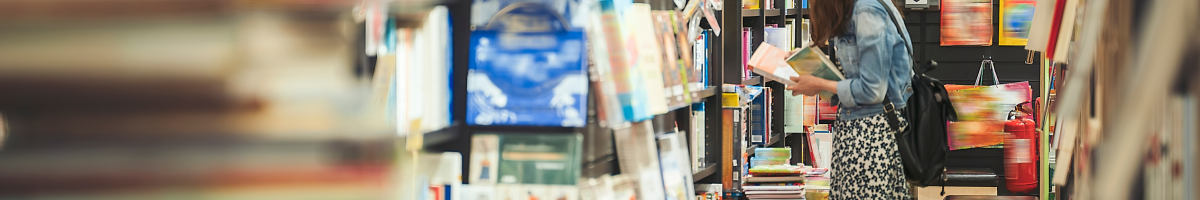
Where is `black shelving`? Image resolution: width=1200 pixels, height=200 pixels. black shelving is located at coordinates (439, 137).